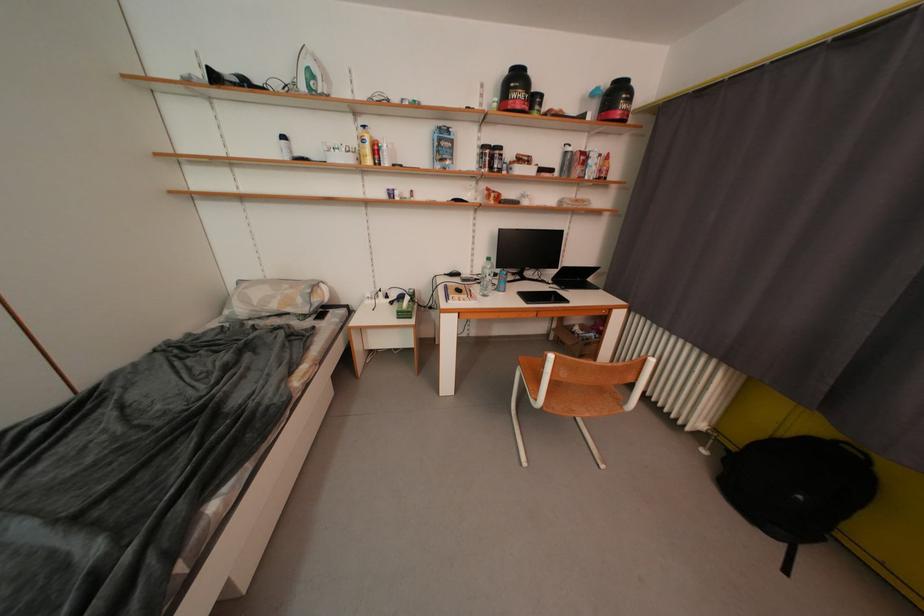
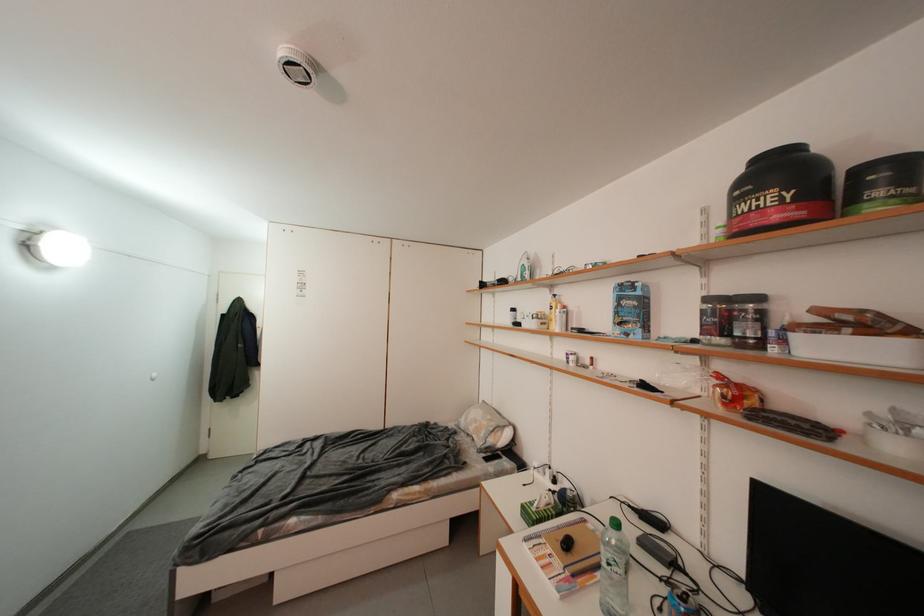
The point at (529, 98) is marked in the first image. Where is the corresponding point in the second image?

(776, 201)